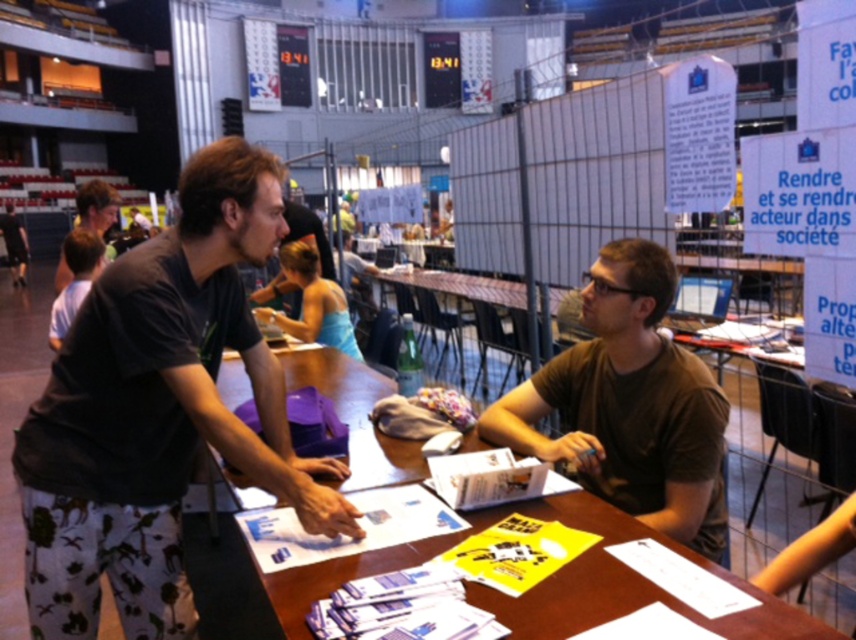
You are standing at the entrance of the conference hall and see the point marked at coordinates (x=629, y=404). Based on the scene description, what object or person is located at that point?

The point at coordinates (x=629, y=404) corresponds to the brown matte shirt at center.